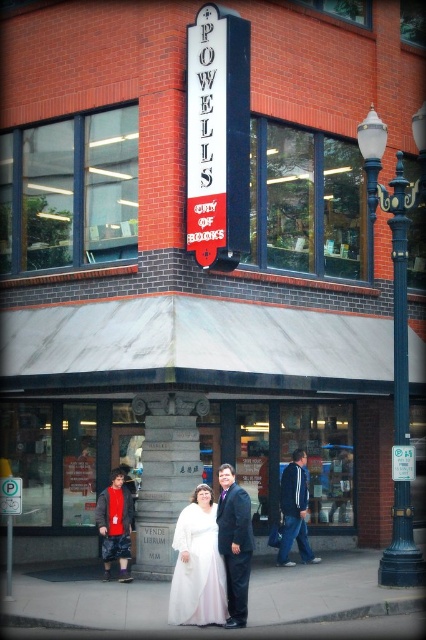
Question: Among these objects, which one is nearest to the camera?

Choices:
 (A) white satin dress at center
 (B) matte black suit at center

Answer: (B)

Question: Which point is farther to the camera?

Choices:
 (A) (290, 500)
 (B) (103, 506)
 (C) (236, 614)

Answer: (A)

Question: Is white satin dress at center above matte black suit at center?

Choices:
 (A) no
 (B) yes

Answer: (A)

Question: Among these objects, which one is nearest to the camera?

Choices:
 (A) white satin robe at lower left
 (B) blue denim jeans at center
 (C) matte black suit at center
 (D) white satin dress at center

Answer: (C)

Question: Can you confirm if white satin dress at center is smaller than blue denim jeans at center?

Choices:
 (A) yes
 (B) no

Answer: (A)

Question: Can you confirm if white satin dress at center is wider than blue denim jeans at center?

Choices:
 (A) no
 (B) yes

Answer: (A)